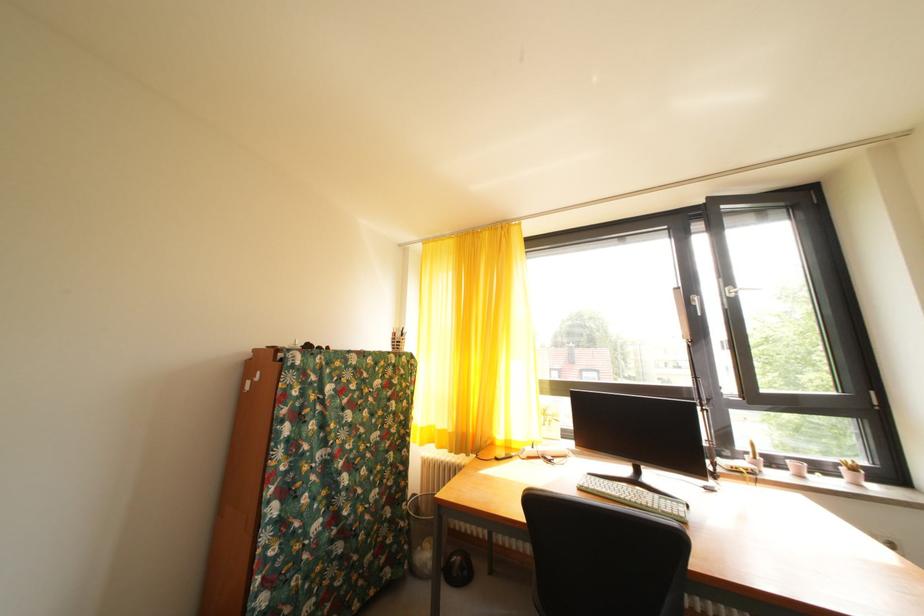
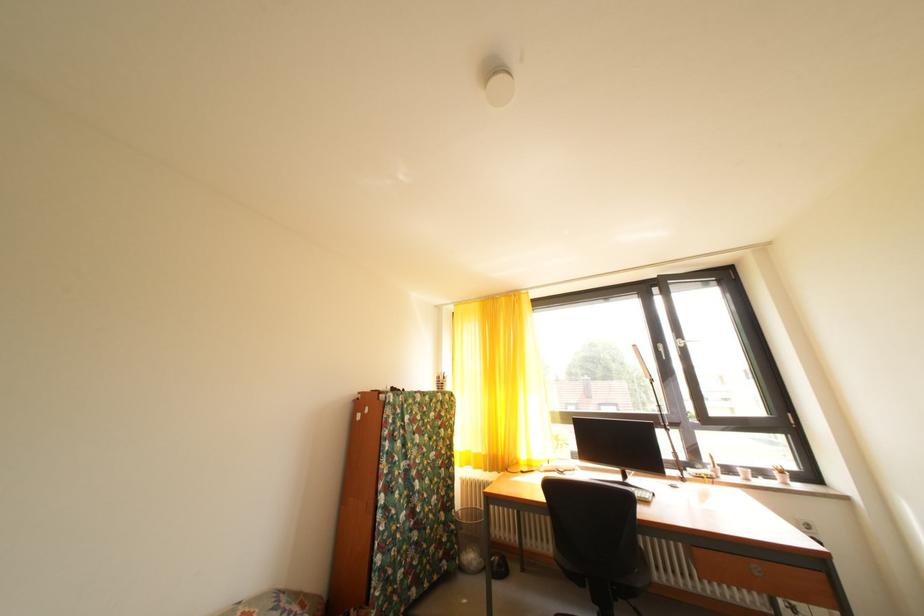
In the second image, find the point that corresponds to the point at 853,476 in the first image.

(784, 479)